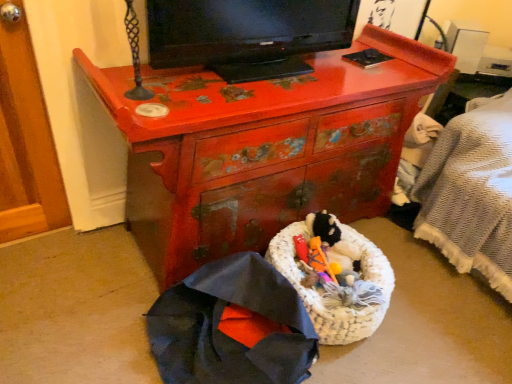
The image size is (512, 384). Find the location of `cherry wood dresser at center`. cherry wood dresser at center is located at coordinates (263, 148).

Measure the distance between point (233, 239) and camera.

They are 1.47 meters apart.

This screenshot has width=512, height=384. In order to click on black glossy television at upper center in this screenshot , I will do `click(247, 35)`.

Can you tell me how much cherry wood dresser at center and white woven laundry basket at center differ in facing direction?

The angle between the facing direction of cherry wood dresser at center and the facing direction of white woven laundry basket at center is 0.531 degrees.

Identify the location of the chest of drawers that is in front of the white woven laundry basket at center. (263, 148).

From the picture: Are cherry wood dresser at center and white woven laundry basket at center beside each other?

There is a gap between cherry wood dresser at center and white woven laundry basket at center.

Between cherry wood dresser at center and white woven laundry basket at center, which one has less height?

Standing shorter between the two is white woven laundry basket at center.

Are cherry wood dresser at center and dark blue fabric umbrella at lower left far apart?

No, cherry wood dresser at center is not far away from dark blue fabric umbrella at lower left.

Is cherry wood dresser at center in front of dark blue fabric umbrella at lower left?

No, cherry wood dresser at center is further to the viewer.

The width and height of the screenshot is (512, 384). What are the coordinates of `clothing in front of the cherry wood dresser at center` in the screenshot? It's located at (226, 335).

Does cherry wood dresser at center turn towards dark blue fabric umbrella at lower left?

Yes, cherry wood dresser at center is turned towards dark blue fabric umbrella at lower left.

How different are the orientations of black glossy television at upper center and cherry wood dresser at center in degrees?

0.74 degrees separate the facing orientations of black glossy television at upper center and cherry wood dresser at center.

Which of these two, black glossy television at upper center or cherry wood dresser at center, is wider?

With larger width is cherry wood dresser at center.

Is black glossy television at upper center positioned far away from cherry wood dresser at center?

No, there isn't a large distance between black glossy television at upper center and cherry wood dresser at center.

Is black glossy television at upper center not inside cherry wood dresser at center?

Absolutely, black glossy television at upper center is external to cherry wood dresser at center.

Which object is further away from the camera, dark blue fabric umbrella at lower left or black glossy television at upper center?

black glossy television at upper center.

Between point (212, 315) and point (201, 28), which one is positioned behind?

Point (212, 315)

Which object is thinner, dark blue fabric umbrella at lower left or black glossy television at upper center?

black glossy television at upper center.

From the image's perspective, is dark blue fabric umbrella at lower left located beneath black glossy television at upper center?

Yes, from the image's perspective, dark blue fabric umbrella at lower left is below black glossy television at upper center.

Is cherry wood dresser at center shorter than black glossy television at upper center?

No, cherry wood dresser at center is not shorter than black glossy television at upper center.

Is cherry wood dresser at center oriented towards black glossy television at upper center?

No, cherry wood dresser at center is not facing towards black glossy television at upper center.

Which is further, [272,205] or [262,16]?

Point [272,205]

Is black glossy television at upper center inside the boundaries of white woven laundry basket at center, or outside?

black glossy television at upper center is outside white woven laundry basket at center.

Considering the positions of points (247, 46) and (385, 288), is point (247, 46) closer to camera compared to point (385, 288)?

That is False.

I want to click on television that is above the white woven laundry basket at center (from a real-world perspective), so click(247, 35).

Considering the positions of objects black glossy television at upper center and white woven laundry basket at center in the image provided, who is more to the right, black glossy television at upper center or white woven laundry basket at center?

white woven laundry basket at center.

Is dark blue fabric umbrella at lower left taller than white woven laundry basket at center?

Yes, dark blue fabric umbrella at lower left is taller than white woven laundry basket at center.

Can white woven laundry basket at center be found inside dark blue fabric umbrella at lower left?

No, dark blue fabric umbrella at lower left does not contain white woven laundry basket at center.

At what (x,y) coordinates should I click in order to perform the action: click on clothing that is above the white woven laundry basket at center (from a real-world perspective). Please return your answer as a coordinate pair (x, y). Looking at the image, I should click on (226, 335).

Locate an element on the screen. laundry basket below the cherry wood dresser at center (from a real-world perspective) is located at coordinates (327, 299).

Where is `clothing on the left of cherry wood dresser at center`? Image resolution: width=512 pixels, height=384 pixels. clothing on the left of cherry wood dresser at center is located at coordinates (226, 335).

When comparing their distances from black glossy television at upper center, does white woven laundry basket at center or cherry wood dresser at center seem closer?

cherry wood dresser at center.

Which object lies nearer to the anchor point white woven laundry basket at center, dark blue fabric umbrella at lower left or black glossy television at upper center?

dark blue fabric umbrella at lower left is positioned closer to the anchor white woven laundry basket at center.

Consider the image. Estimate the real-world distances between objects in this image. Which object is further from cherry wood dresser at center, black glossy television at upper center or white woven laundry basket at center?

The object further to cherry wood dresser at center is white woven laundry basket at center.

Based on their spatial positions, is cherry wood dresser at center or white woven laundry basket at center further from dark blue fabric umbrella at lower left?

cherry wood dresser at center is further to dark blue fabric umbrella at lower left.

Looking at the image, which one is located closer to cherry wood dresser at center, dark blue fabric umbrella at lower left or black glossy television at upper center?

black glossy television at upper center is positioned closer to the anchor cherry wood dresser at center.

When comparing their distances from black glossy television at upper center, does cherry wood dresser at center or white woven laundry basket at center seem closer?

cherry wood dresser at center lies closer to black glossy television at upper center than the other object.

Looking at the image, which one is located further to white woven laundry basket at center, dark blue fabric umbrella at lower left or cherry wood dresser at center?

The object further to white woven laundry basket at center is cherry wood dresser at center.

Based on their spatial positions, is black glossy television at upper center or cherry wood dresser at center closer to dark blue fabric umbrella at lower left?

cherry wood dresser at center is positioned closer to the anchor dark blue fabric umbrella at lower left.

In order to click on laundry basket between black glossy television at upper center and dark blue fabric umbrella at lower left vertically in this screenshot , I will do `click(327, 299)`.

Locate an element on the screen. Image resolution: width=512 pixels, height=384 pixels. the chest of drawers that lies between black glossy television at upper center and white woven laundry basket at center from top to bottom is located at coordinates (263, 148).

Where is `chest of drawers between black glossy television at upper center and dark blue fabric umbrella at lower left from top to bottom`? This screenshot has width=512, height=384. chest of drawers between black glossy television at upper center and dark blue fabric umbrella at lower left from top to bottom is located at coordinates (263, 148).

Where is `laundry basket that lies between cherry wood dresser at center and dark blue fabric umbrella at lower left from top to bottom`? laundry basket that lies between cherry wood dresser at center and dark blue fabric umbrella at lower left from top to bottom is located at coordinates pyautogui.click(x=327, y=299).